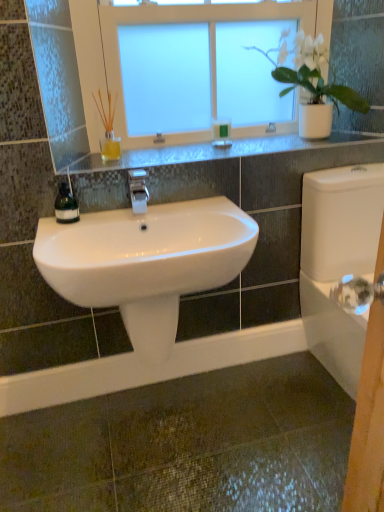
Question: Considering the positions of point (144, 192) and point (206, 147), is point (144, 192) closer or farther from the camera than point (206, 147)?

Choices:
 (A) closer
 (B) farther

Answer: (A)

Question: In terms of width, does white glossy faucet at center look wider or thinner when compared to satin silver shelf at upper center?

Choices:
 (A) thin
 (B) wide

Answer: (A)

Question: Which object is positioned farthest from the satin silver shelf at upper center?

Choices:
 (A) white glossy faucet at center
 (B) white glossy porcelain at right
 (C) green matte soap dispenser at left
 (D) white frosted glass window at upper center
 (E) white matte pot at upper right

Answer: (C)

Question: Estimate the real-world distances between objects in this image. Which object is closer to the white frosted glass window at upper center?

Choices:
 (A) white matte pot at upper right
 (B) white glossy faucet at center
 (C) satin silver shelf at upper center
 (D) white glossy porcelain at right
 (E) green matte soap at upper center

Answer: (A)